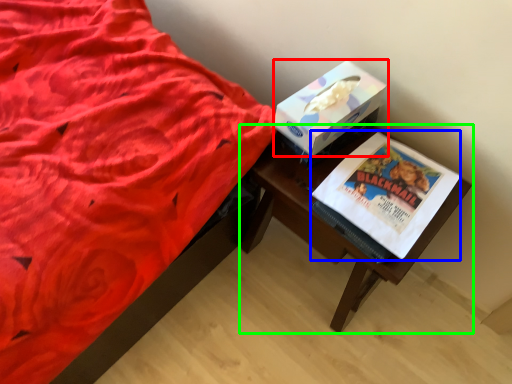
Question: Estimate the real-world distances between objects in this image. Which object is closer to box (highlighted by a red box), paperback book (highlighted by a blue box) or table (highlighted by a green box)?

Choices:
 (A) paperback book
 (B) table

Answer: (A)